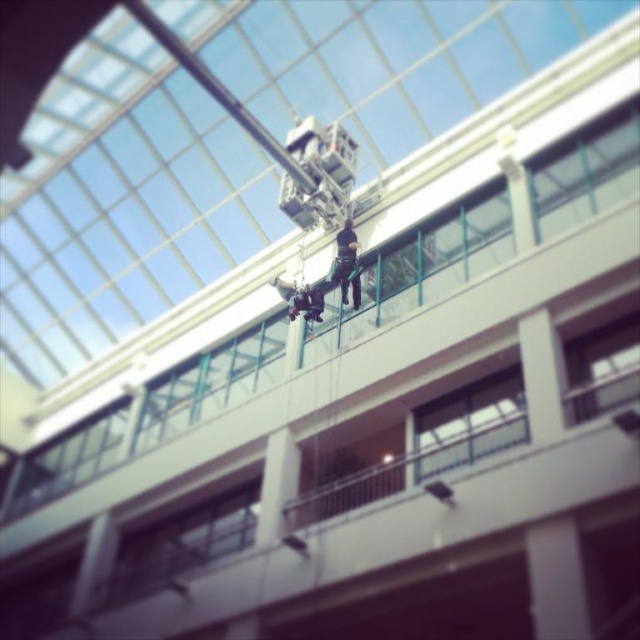
Based on the photo, you are standing at the base of the building and want to reach the point marked as point [148,556]. If your ladder can extend up to 25 meters, will it be sufficient to reach that point?

The distance of point [148,556] from camera is 25.48 meters, so the ladder can only extend up to 25 meters, which is shorter than the required distance. Therefore, the ladder is not sufficient to reach the point.

You are standing in the modern building with a glass roof and notice the clear glass window at upper center. Where exactly is this window positioned in relation to the person suspended from the crane?

The clear glass window at upper center is located at point 0.270 on the x and 0.916 on the y coordinate, so it is positioned to the upper right of the person suspended from the crane.

You are standing in the modern building and want to move from the point at coordinates point (179, 556) to the point at coordinates point (417, 440). Which direction do you need to move in order to get closer to the second point?

To move from point (179, 556) to point (417, 440), you need to move downward and to the left because point (179, 556) is further to the camera than point (417, 440).